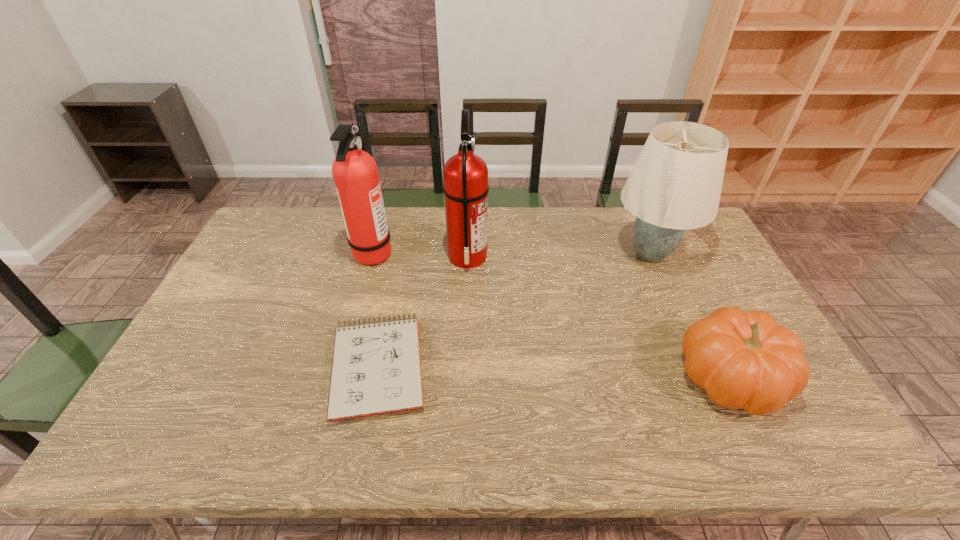
Image resolution: width=960 pixels, height=540 pixels. I want to click on vacant space in between the left fire extinguisher and the right fire extinguisher, so click(420, 254).

What are the coordinates of `free space that is in between the notepad and the left fire extinguisher` in the screenshot? It's located at (376, 309).

The height and width of the screenshot is (540, 960). I want to click on empty location between the right fire extinguisher and the second shortest object, so click(599, 317).

The height and width of the screenshot is (540, 960). I want to click on object that is the third closest to the lampshade, so click(x=376, y=368).

Where is `object that can be found as the fourth closest to the right fire extinguisher`? The height and width of the screenshot is (540, 960). object that can be found as the fourth closest to the right fire extinguisher is located at coordinates (744, 360).

What are the coordinates of `free space that satisfies the following two spatial constraints: 1. on the handle side of the second shortest object; 2. on the left side of the left fire extinguisher` in the screenshot? It's located at (339, 377).

Find the location of a particular element. This screenshot has height=540, width=960. vacant space that satisfies the following two spatial constraints: 1. on the handle side of the lampshade; 2. on the right side of the left fire extinguisher is located at coordinates (372, 254).

At what (x,y) coordinates should I click in order to perform the action: click on vacant area that satisfies the following two spatial constraints: 1. on the back side of the shortest object; 2. on the handle side of the left fire extinguisher. Please return your answer as a coordinate pair (x, y). The image size is (960, 540). Looking at the image, I should click on (401, 252).

Where is `free space that satisfies the following two spatial constraints: 1. at the nozzle of the pumpkin; 2. on the left side of the right fire extinguisher`? free space that satisfies the following two spatial constraints: 1. at the nozzle of the pumpkin; 2. on the left side of the right fire extinguisher is located at coordinates (464, 377).

Locate an element on the screen. This screenshot has height=540, width=960. free spot that satisfies the following two spatial constraints: 1. at the nozzle of the right fire extinguisher; 2. on the left side of the second shortest object is located at coordinates (464, 377).